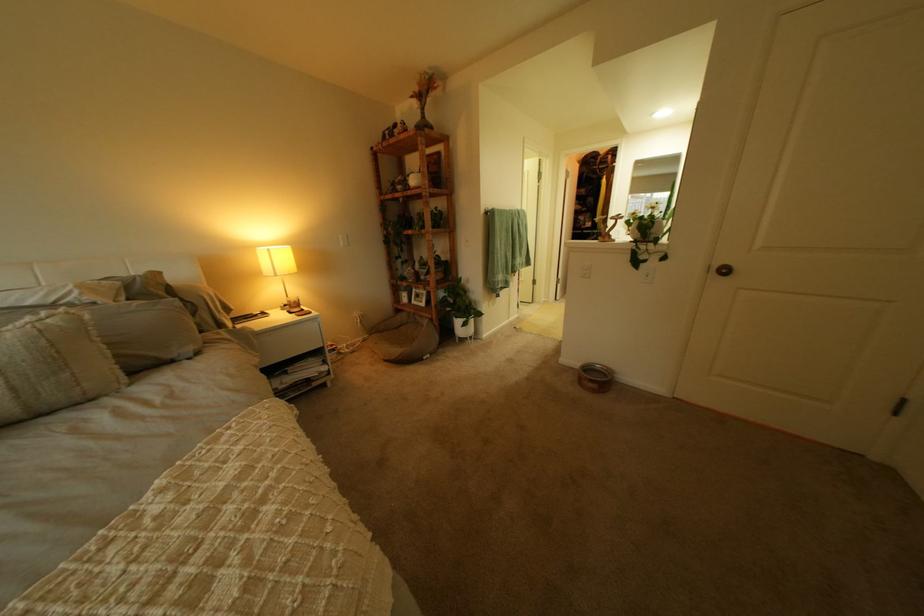
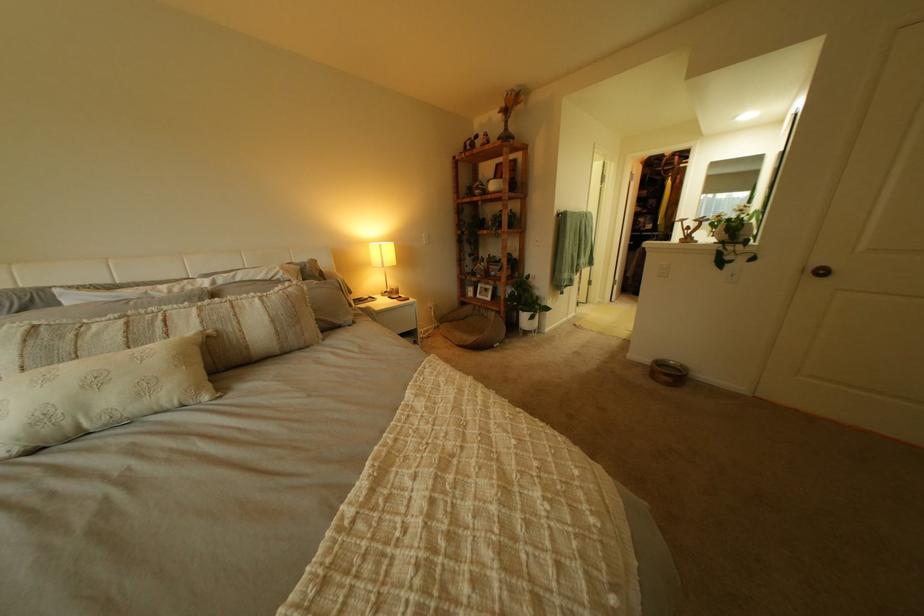
Locate, in the second image, the point that corresponds to point (420, 306) in the first image.

(485, 300)